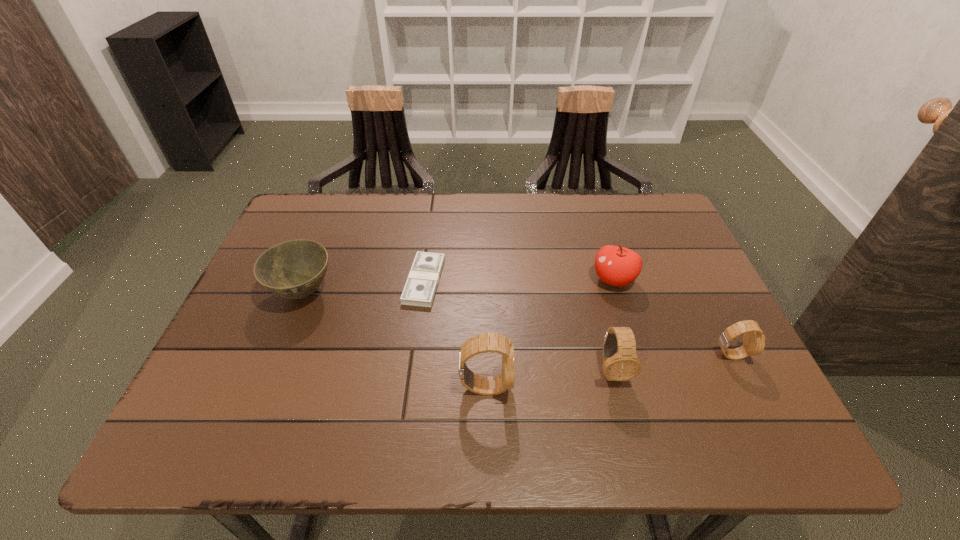
At what (x,y) coordinates should I click in order to perform the action: click on free space between the leftmost object and the second watch from right to left. Please return your answer as a coordinate pair (x, y). Looking at the image, I should click on (457, 332).

Where is `free area in between the rightmost object and the second shortest watch`? Image resolution: width=960 pixels, height=540 pixels. free area in between the rightmost object and the second shortest watch is located at coordinates (671, 363).

Identify the location of unoccupied position between the rightmost watch and the second watch from right to left. Image resolution: width=960 pixels, height=540 pixels. (671, 363).

Find the location of a particular element. The height and width of the screenshot is (540, 960). free area in between the dollar and the apple is located at coordinates (518, 280).

Identify the location of free area in between the third object from left to right and the apple. (549, 333).

The width and height of the screenshot is (960, 540). I want to click on free point between the rightmost object and the apple, so click(672, 318).

Locate an element on the screen. The width and height of the screenshot is (960, 540). unoccupied position between the tallest object and the shortest object is located at coordinates (455, 334).

Identify the location of free area in between the apple and the tallest object. The height and width of the screenshot is (540, 960). (549, 333).

I want to click on vacant region between the bowl and the leftmost watch, so click(395, 340).

In order to click on free spot between the second watch from left to right and the leftmost object in this screenshot , I will do `click(457, 332)`.